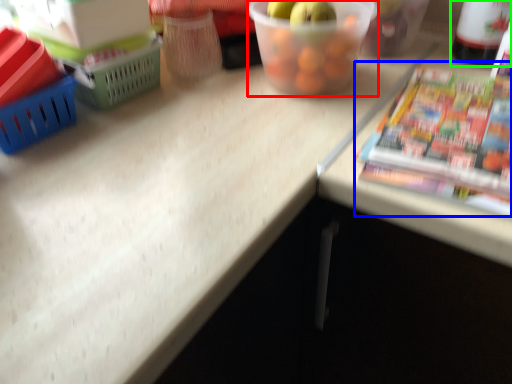
Question: Which object is positioned farthest from glass bowl (highlighted by a red box)? Select from paperback book (highlighted by a blue box) and bottle (highlighted by a green box).

Choices:
 (A) paperback book
 (B) bottle

Answer: (B)